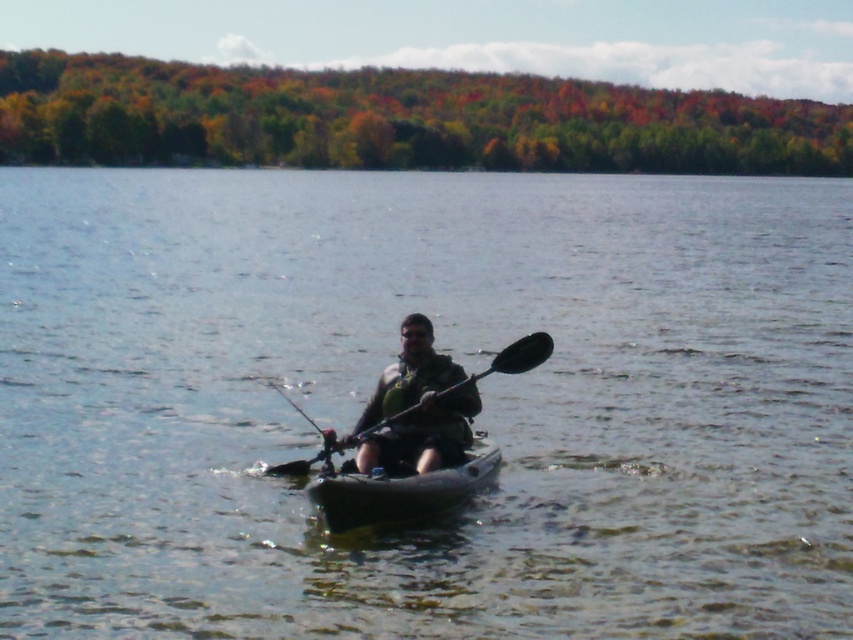
Image resolution: width=853 pixels, height=640 pixels. I want to click on clear water at center, so click(x=467, y=372).

This screenshot has width=853, height=640. Describe the element at coordinates (467, 372) in the screenshot. I see `clear water at center` at that location.

You are a GUI agent. You are given a task and a screenshot of the screen. Output one action in this format:
    pyautogui.click(x=<x>, y=<y>)
    Task: Click on the clear water at center
    The image size is (853, 640).
    Given the screenshot: What is the action you would take?
    pyautogui.click(x=467, y=372)

Find the location of `clear water at center`. clear water at center is located at coordinates (467, 372).

Where is `camouflage fabric kayak at center`? This screenshot has height=640, width=853. camouflage fabric kayak at center is located at coordinates (416, 408).

Measure the distance between point (422,451) and camera.

The distance of point (422,451) from camera is 13.93 meters.

What are the coordinates of `camouflage fabric kayak at center` in the screenshot? It's located at (416, 408).

Who is positioned more to the left, clear water at center or black plastic paddle at center?

Positioned to the left is clear water at center.

Can you confirm if clear water at center is positioned below black plastic paddle at center?

Actually, clear water at center is above black plastic paddle at center.

Between point (585, 364) and point (274, 472), which one is positioned in front?

Point (274, 472)

The width and height of the screenshot is (853, 640). I want to click on clear water at center, so click(x=467, y=372).